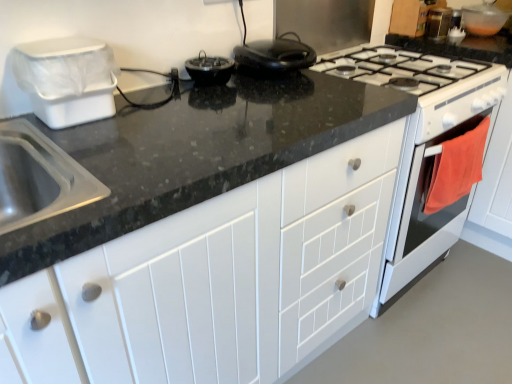
Find the location of a particular element. The image size is (512, 384). free spot below white plastic bin at left, the third appliance viewed from the right (from a real-world perspective) is located at coordinates (78, 124).